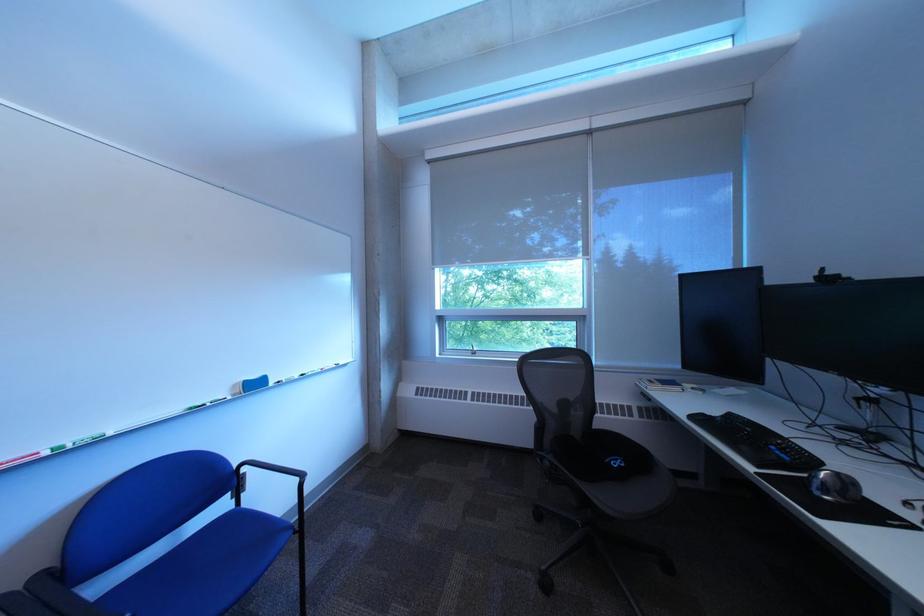
What are the coordinates of `white spiral notebook` in the screenshot? It's located at (661, 384).